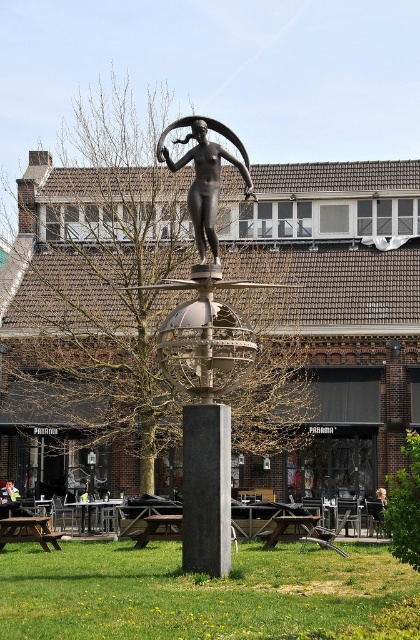
You are standing at the origin point of the image coordinate system. The sculpture is located at the center. Can you see the smooth gray pole at center from your current position?

Yes, the smooth gray pole at center is located at point (205, 490), which is within the central area of the image coordinate system, so it is visible from the origin point.

You are standing at the base of the brown leafless tree at center and want to take a photo of the public sculpture. The camera you have can capture objects up to 200 feet away. Will the sculpture be in focus if you take the photo from here?

The brown leafless tree at center and camera are 187.24 feet apart. Since the camera can capture objects up to 200 feet away, the sculpture will be within range and should be in focus.

You are a photographer standing in front of the sculpture. You want to take a photo that includes both the point at coordinates point (244, 449) and point (228, 484). Which point should you focus on to ensure both are in sharp focus?

You should focus on point (244, 449) because it is closer to the camera than point (228, 484). By focusing on the closer point, the depth of field will likely include both points in sharp focus.